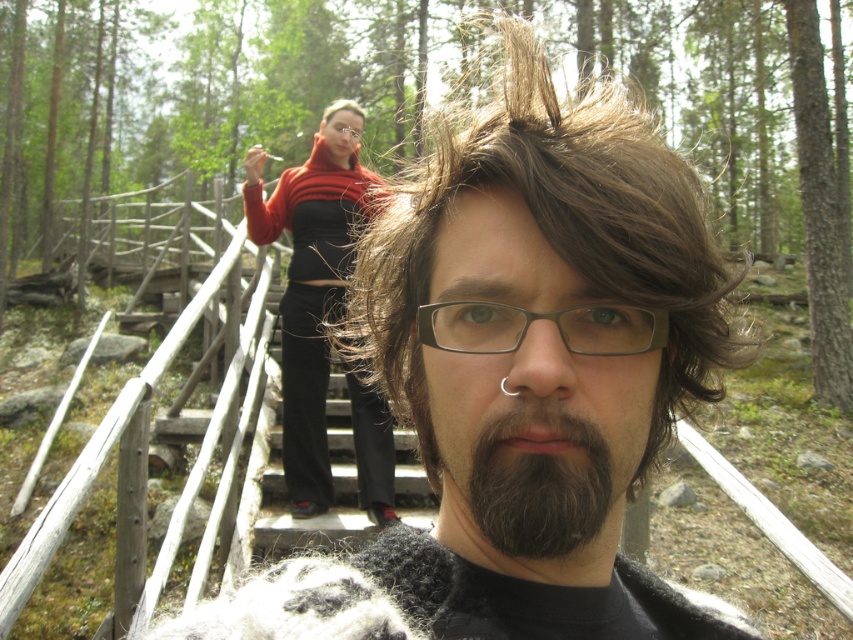
You are a photographer trying to capture a closeup shot of the brown wavy hair at center. Your camera has a minimum focusing distance of 15 inches. Will you be able to take the photo without moving closer?

The brown wavy hair at center is 14.56 inches from the camera, which is within the minimum focusing distance of 15 inches. Therefore, you can take the photo without moving closer.

Based on the scene description, which object occupies more horizontal space in the image? Please compare the width of the green matte forest at upper center and the brown wavy hair at center.

The green matte forest at upper center has a larger width than the brown wavy hair at center, so it occupies more horizontal space.

You are a photographer trying to capture a clear shot of the person with the dark brown fuzzy beard at center. However, their face is partially obscured by the brown wavy hair at center. What adjustment should you suggest to the subject to improve visibility?

The dark brown fuzzy beard at center is behind the brown wavy hair at center, so the subject should move their dark brown fuzzy beard at center forward or adjust their brown wavy hair at center to allow better visibility.